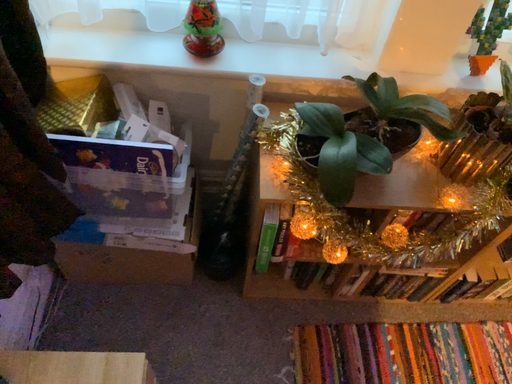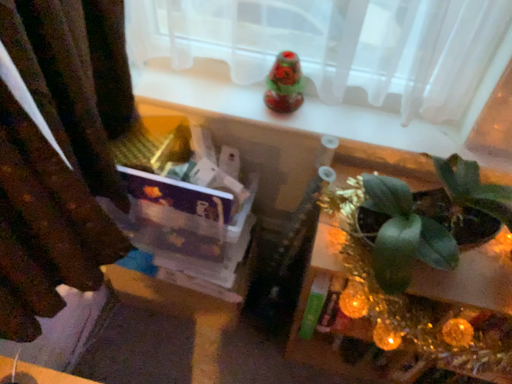
Question: Which way did the camera rotate in the video?

Choices:
 (A) rotated left
 (B) rotated right

Answer: (A)